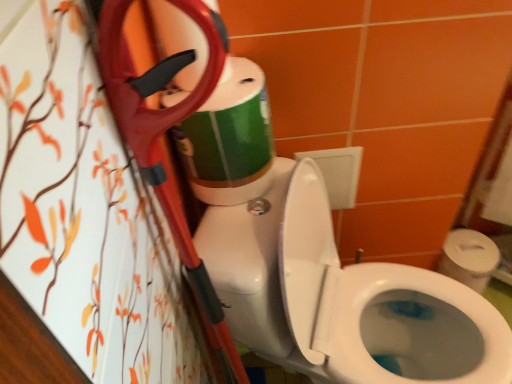
Question: Can we say white glossy toilet at center lies outside green matte toilet paper at upper center?

Choices:
 (A) yes
 (B) no

Answer: (A)

Question: From a real-world perspective, does white glossy toilet at center stand above green matte toilet paper at upper center?

Choices:
 (A) no
 (B) yes

Answer: (A)

Question: Is white glossy toilet at center wider than green matte toilet paper at upper center?

Choices:
 (A) yes
 (B) no

Answer: (A)

Question: Is white glossy toilet at center not near green matte toilet paper at upper center?

Choices:
 (A) yes
 (B) no

Answer: (B)

Question: Could you tell me if white glossy toilet at center is facing green matte toilet paper at upper center?

Choices:
 (A) yes
 (B) no

Answer: (B)

Question: Is white glossy toilet at center thinner than green matte toilet paper at upper center?

Choices:
 (A) no
 (B) yes

Answer: (A)

Question: Can you confirm if green matte toilet paper at upper center is taller than white glossy toilet at center?

Choices:
 (A) no
 (B) yes

Answer: (A)

Question: Is green matte toilet paper at upper center positioned in front of white glossy toilet at center?

Choices:
 (A) no
 (B) yes

Answer: (A)

Question: Does green matte toilet paper at upper center have a smaller size compared to white glossy toilet at center?

Choices:
 (A) no
 (B) yes

Answer: (B)

Question: From a real-world perspective, is green matte toilet paper at upper center physically above white glossy toilet at center?

Choices:
 (A) yes
 (B) no

Answer: (A)

Question: Could you tell me if green matte toilet paper at upper center is facing white glossy toilet at center?

Choices:
 (A) no
 (B) yes

Answer: (A)

Question: Is green matte toilet paper at upper center at the left side of white glossy toilet at center?

Choices:
 (A) yes
 (B) no

Answer: (A)

Question: Visually, is white glossy toilet at center positioned to the left or to the right of green matte toilet paper at upper center?

Choices:
 (A) right
 (B) left

Answer: (A)